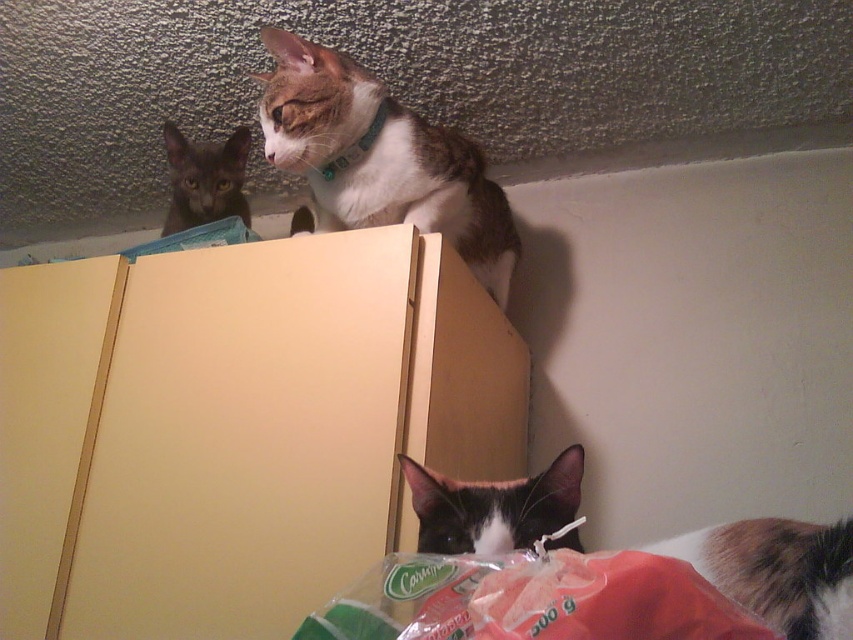
Is brown and white fur at upper center closer to the viewer compared to dark gray fur at upper left?

Yes, brown and white fur at upper center is in front of dark gray fur at upper left.

Which is more to the left, brown and white fur at upper center or dark gray fur at upper left?

Positioned to the left is dark gray fur at upper left.

Where is `brown and white fur at upper center`? The image size is (853, 640). brown and white fur at upper center is located at coordinates (380, 157).

Can you confirm if brown and white fur at upper center is shorter than black and white fur cat at lower right?

No.

Is point (410, 195) positioned in front of point (685, 557)?

No, it is behind (685, 557).

Is point (492, 189) closer to camera compared to point (827, 548)?

No, it is behind (827, 548).

Where is `brown and white fur at upper center`? Image resolution: width=853 pixels, height=640 pixels. brown and white fur at upper center is located at coordinates (380, 157).

Between black and white fur cat at lower right and black fur cat at lower center, which one has more height?

With more height is black and white fur cat at lower right.

Does black and white fur cat at lower right appear on the left side of black fur cat at lower center?

No, black and white fur cat at lower right is not to the left of black fur cat at lower center.

Is point (418, 531) farther from camera compared to point (430, 550)?

Yes, it is behind point (430, 550).

Where is `black and white fur cat at lower right`? The height and width of the screenshot is (640, 853). black and white fur cat at lower right is located at coordinates (776, 572).